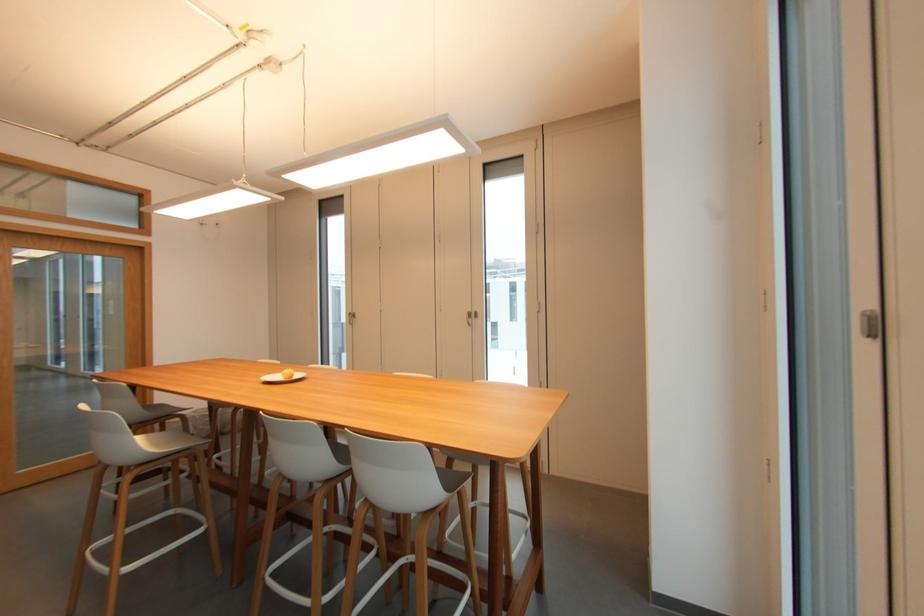
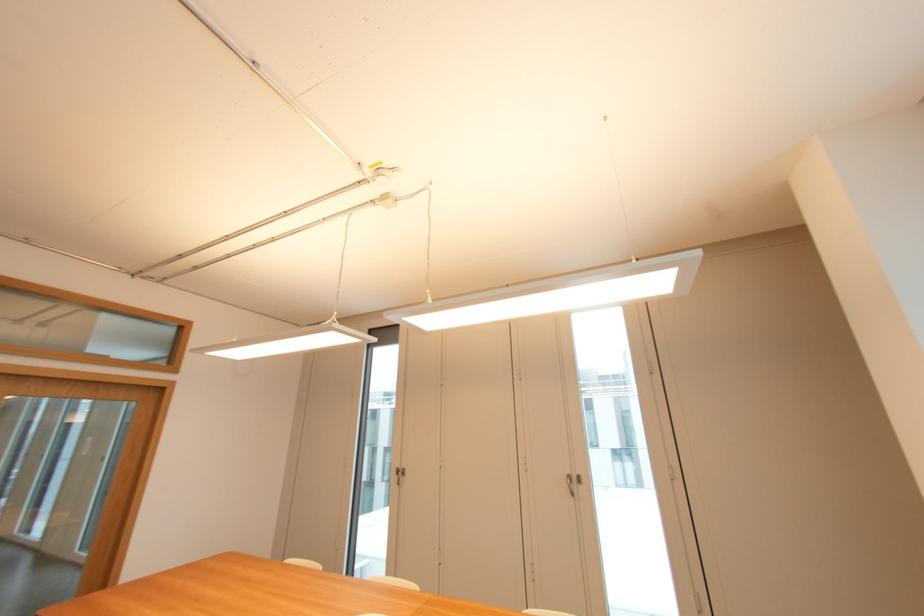
Question: How did the camera likely rotate?

Choices:
 (A) Left
 (B) Right
 (C) Up
 (D) Down

Answer: (C)